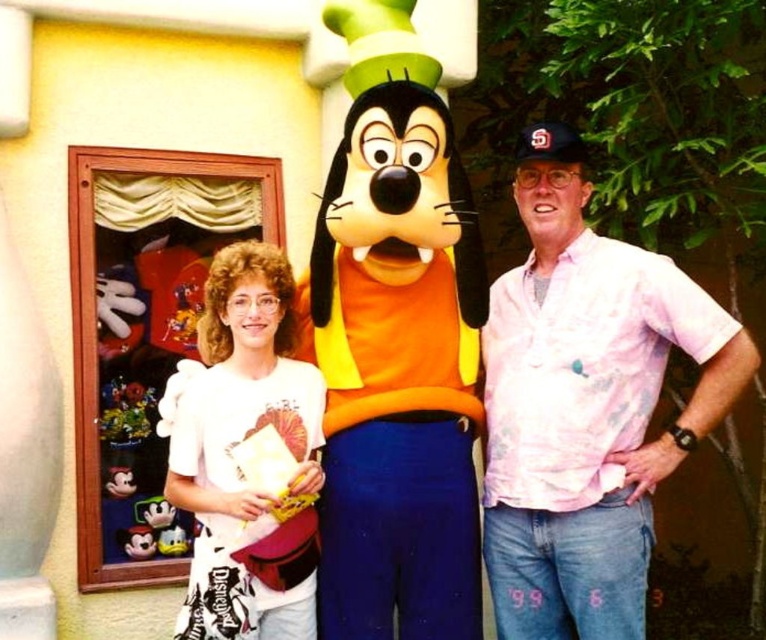
You are a photographer taking a photo of the two people wearing the pink floral shirt at right and the white cotton shirt at left. Which person is positioned higher in the frame?

The pink floral shirt at right is located above the white cotton shirt at left, so the person wearing the pink floral shirt at right is positioned higher in the frame.

From the picture: You are a photographer trying to capture a group photo. You notice two people wearing shirts with different sizes in the scene. Which person is wearing the larger shirt, the one in the pink floral shirt at right or the one in the white cotton shirt at left?

The pink floral shirt at right has a larger size compared to the white cotton shirt at left, so the person wearing the pink floral shirt at right is wearing the larger shirt.

You are a photographer trying to frame a group photo. You have two people wearing a pink floral shirt at right and a white cotton shirt at left. If you want to ensure both shirts are visible in the frame, which shirt should you adjust your camera angle to focus on first?

The pink floral shirt at right has a larger width than the white cotton shirt at left. Therefore, you should adjust your camera angle to focus on the pink floral shirt at right first to ensure both shirts are visible in the frame.